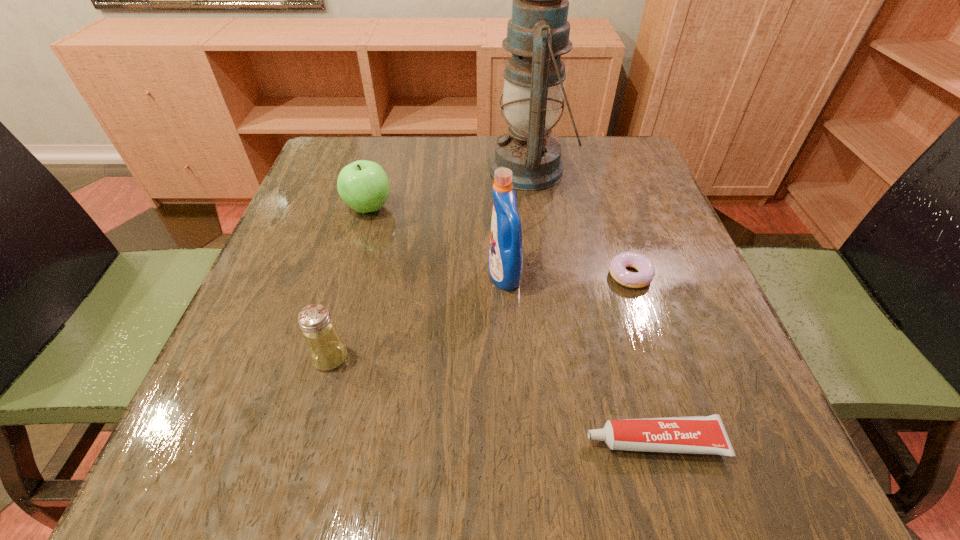
Locate an element on the screen. vacant area located 0.300m on the label of the detergent is located at coordinates (328, 275).

This screenshot has width=960, height=540. In order to click on free space located 0.360m on the right of the apple in this screenshot , I will do `click(557, 207)`.

Image resolution: width=960 pixels, height=540 pixels. I want to click on free space located 0.380m on the right of the fifth farthest object, so click(x=588, y=357).

Where is `vacant space located 0.070m at the nozzle of the toothpaste`? The height and width of the screenshot is (540, 960). vacant space located 0.070m at the nozzle of the toothpaste is located at coordinates (536, 441).

The image size is (960, 540). What are the coordinates of `vacant region located at the nozzle of the toothpaste` in the screenshot? It's located at (368, 441).

This screenshot has height=540, width=960. I want to click on vacant point located 0.130m at the nozzle of the toothpaste, so click(492, 441).

This screenshot has width=960, height=540. I want to click on vacant area located 0.060m on the left of the shortest object, so click(x=577, y=275).

This screenshot has width=960, height=540. What are the coordinates of `object situated at the far edge` in the screenshot? It's located at (538, 33).

Identify the location of object positioned at the near edge. This screenshot has width=960, height=540. (706, 434).

Where is `apple situated at the left edge`? The height and width of the screenshot is (540, 960). apple situated at the left edge is located at coordinates (363, 185).